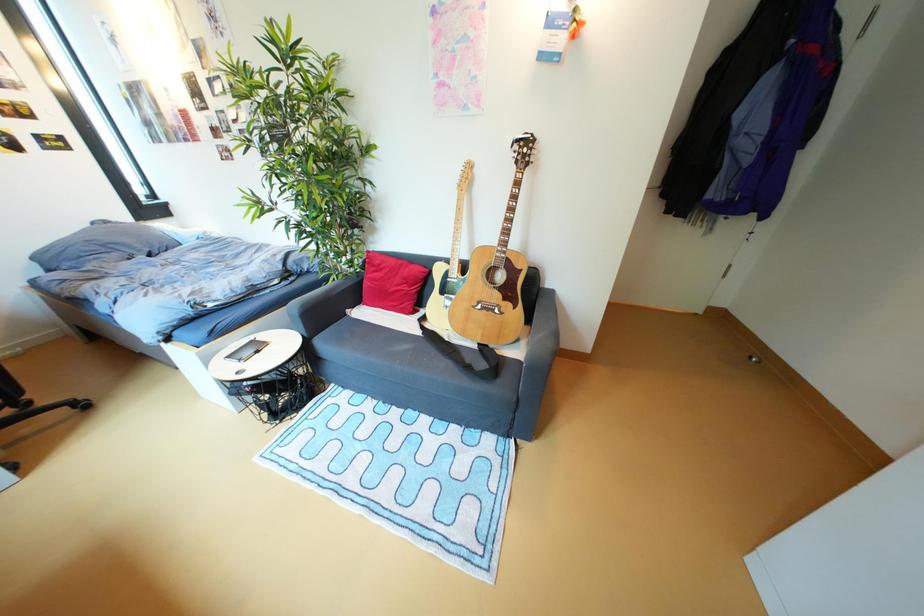
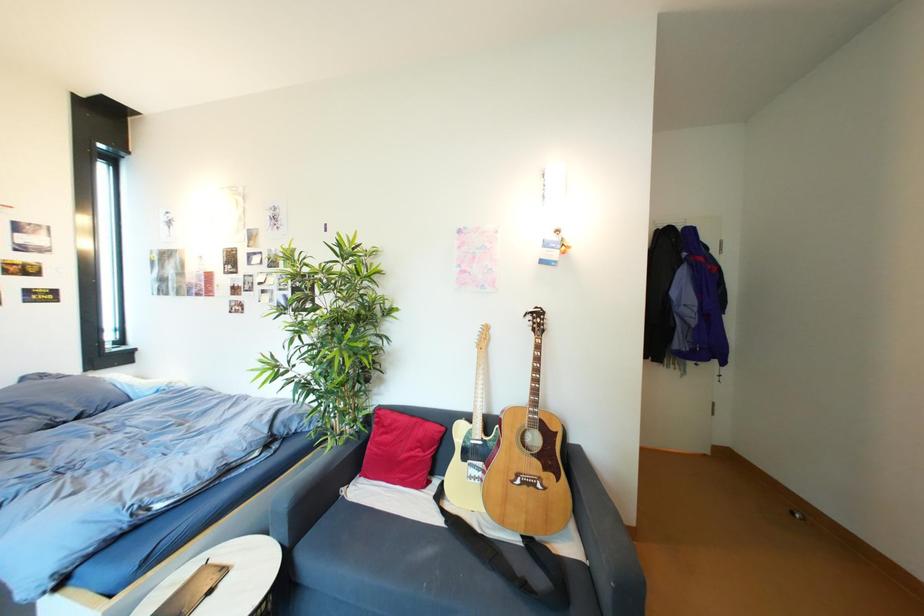
Question: In a continuous first-person perspective shot, in which direction is the camera moving?

Choices:
 (A) Left
 (B) Right
 (C) Forward
 (D) Backward

Answer: (A)